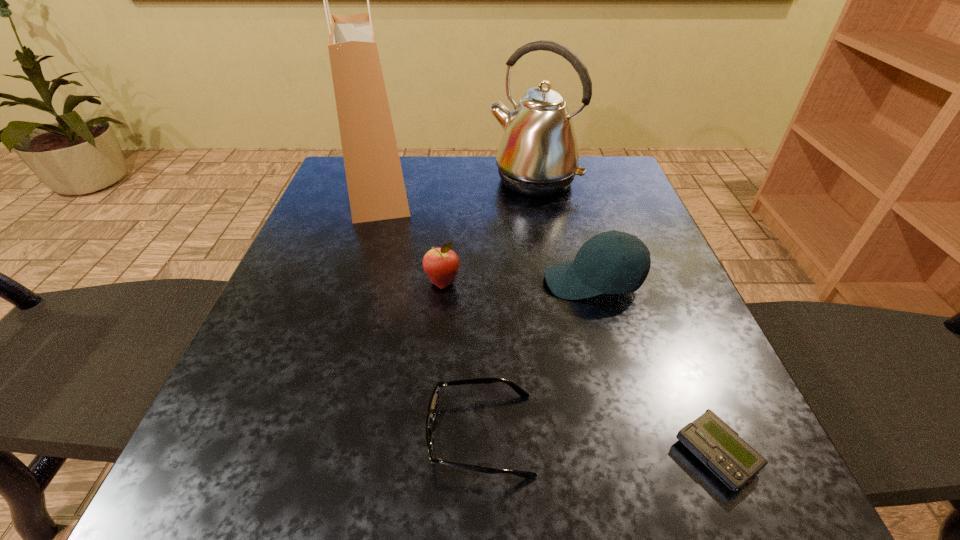
This screenshot has width=960, height=540. In order to click on vacant area between the baseball cap and the leftmost object in this screenshot , I will do `click(486, 234)`.

You are a GUI agent. You are given a task and a screenshot of the screen. Output one action in this format:
    pyautogui.click(x=<x>, y=<y>)
    Task: Click on the free space that is in between the second shortest object and the fifth shortest object
    The height and width of the screenshot is (540, 960).
    Given the screenshot: What is the action you would take?
    pyautogui.click(x=507, y=307)

Identify the location of vacant space that's between the apple and the spectacles. The width and height of the screenshot is (960, 540). (462, 358).

Identify the location of vacant area that lies between the apple and the spectacles. (462, 358).

You are a GUI agent. You are given a task and a screenshot of the screen. Output one action in this format:
    pyautogui.click(x=<x>, y=<y>)
    Task: Click on the free space between the second shortest object and the beeper
    
    Given the screenshot: What is the action you would take?
    pyautogui.click(x=598, y=444)

Identify which object is the fourth nearest to the fifth tallest object. Please provide its 2D coordinates. Your answer should be formatted as a tuple, i.e. [(x, y)], where the tuple contains the x and y coordinates of a point satisfying the conditions above.

[(376, 188)]

Identify the location of object that is the fourth closest one to the shortest object. The width and height of the screenshot is (960, 540). (538, 156).

Locate an element on the screen. This screenshot has width=960, height=540. vacant area that satisfies the following two spatial constraints: 1. on the front-facing side of the baseball cap; 2. on the back side of the beeper is located at coordinates (642, 455).

Identify the location of vacant space that satisfies the following two spatial constraints: 1. on the front-facing side of the baseball cap; 2. on the right side of the beeper. The width and height of the screenshot is (960, 540). (642, 455).

You are a GUI agent. You are given a task and a screenshot of the screen. Output one action in this format:
    pyautogui.click(x=<x>, y=<y>)
    Task: Click on the vacant space that satisfies the following two spatial constraints: 1. on the front-facing side of the spectacles; 2. on the left side of the beeper
    
    Given the screenshot: What is the action you would take?
    pyautogui.click(x=481, y=455)